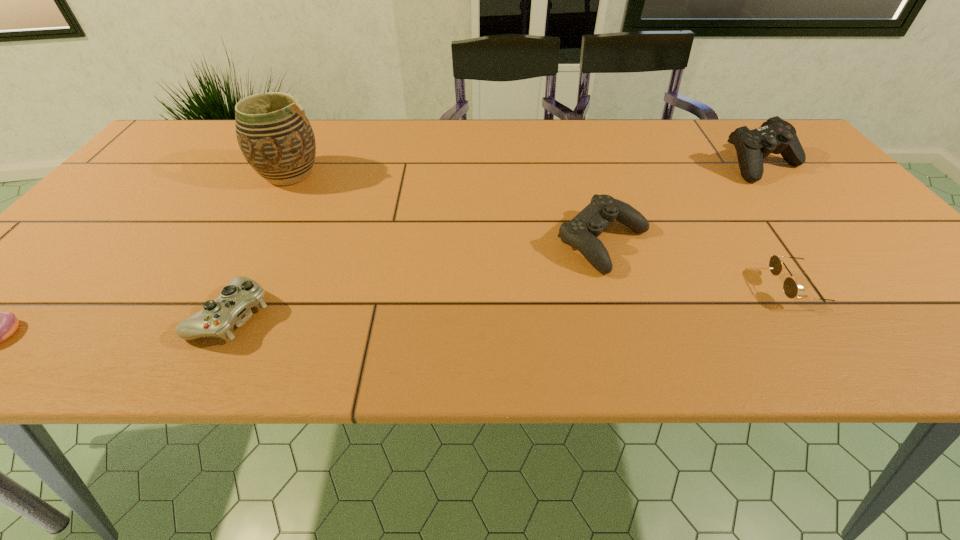
Locate an element on the screen. pottery is located at coordinates (276, 138).

Identify the location of the farthest control. The image size is (960, 540). (776, 136).

At what (x,y) coordinates should I click in order to perform the action: click on the second tallest object. Please return your answer as a coordinate pair (x, y). This screenshot has height=540, width=960. Looking at the image, I should click on (776, 136).

At what (x,y) coordinates should I click in order to perform the action: click on the second nearest control. Please return your answer as a coordinate pair (x, y). This screenshot has width=960, height=540. Looking at the image, I should click on (581, 232).

At what (x,y) coordinates should I click in order to perform the action: click on the third object from right to left. Please return your answer as a coordinate pair (x, y). Image resolution: width=960 pixels, height=540 pixels. Looking at the image, I should click on (581, 232).

The image size is (960, 540). What are the coordinates of `the leftmost control` in the screenshot? It's located at (231, 308).

Identify the location of sunglasses. (790, 287).

The image size is (960, 540). I want to click on vacant space located 0.140m on the back of the tallest object, so (312, 131).

Identify the location of free location located on the front of the farthest control. (876, 303).

Locate an element on the screen. This screenshot has height=540, width=960. free location located on the left of the second nearest control is located at coordinates (432, 242).